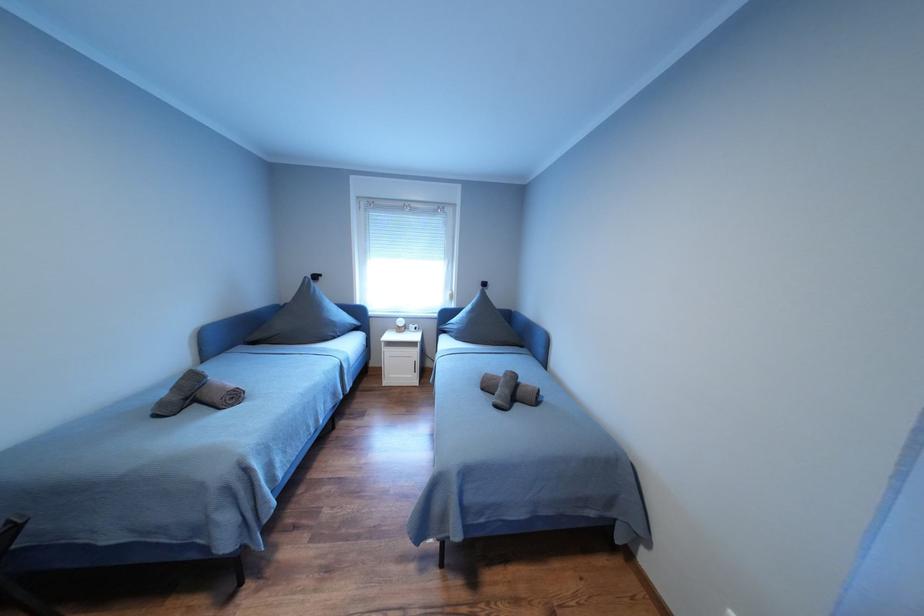
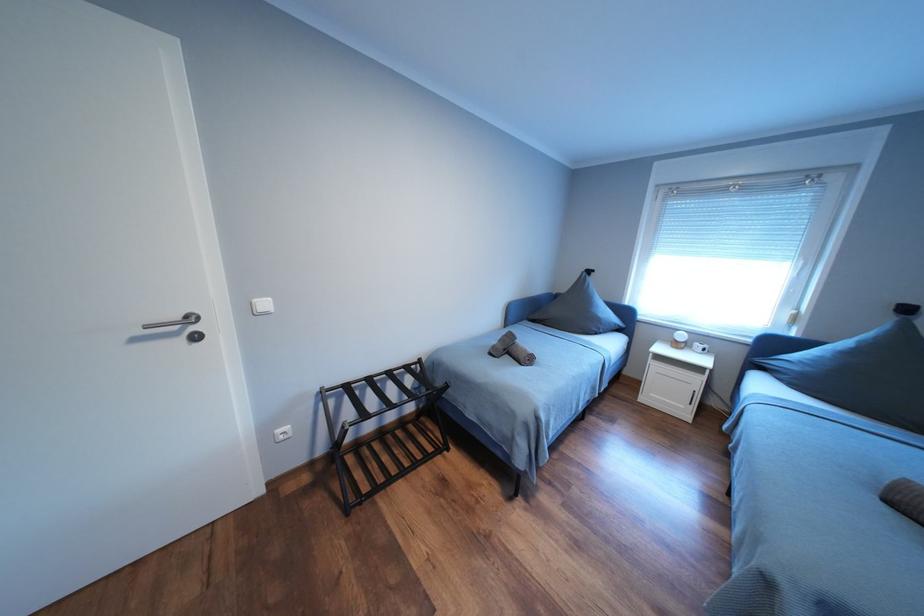
Question: The first image is from the beginning of the video and the second image is from the end. How did the camera likely rotate when shooting the video?

Choices:
 (A) Left
 (B) Right
 (C) Up
 (D) Down

Answer: (A)